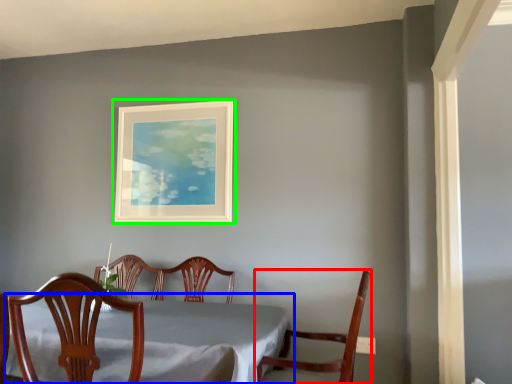
Question: Which is farther away from chair (highlighted by a red box)? table (highlighted by a blue box) or picture frame (highlighted by a green box)?

Choices:
 (A) table
 (B) picture frame

Answer: (B)